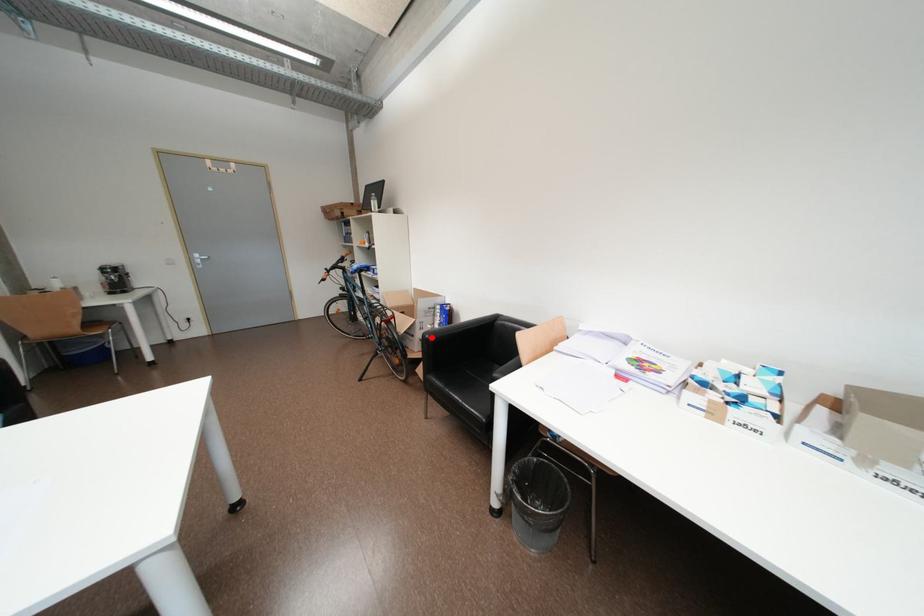
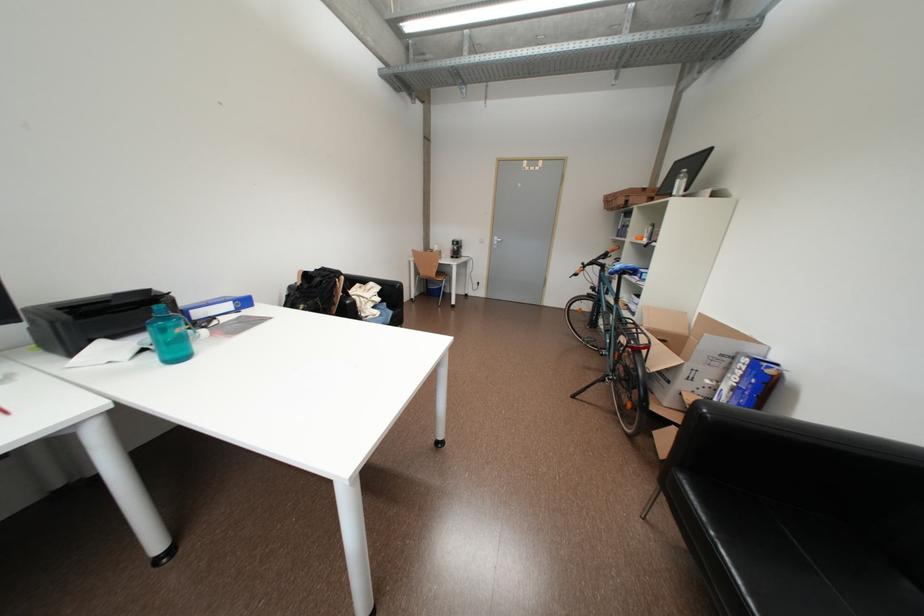
Find the pixel in the second image that matches the highlighted location in the first image.

(704, 406)